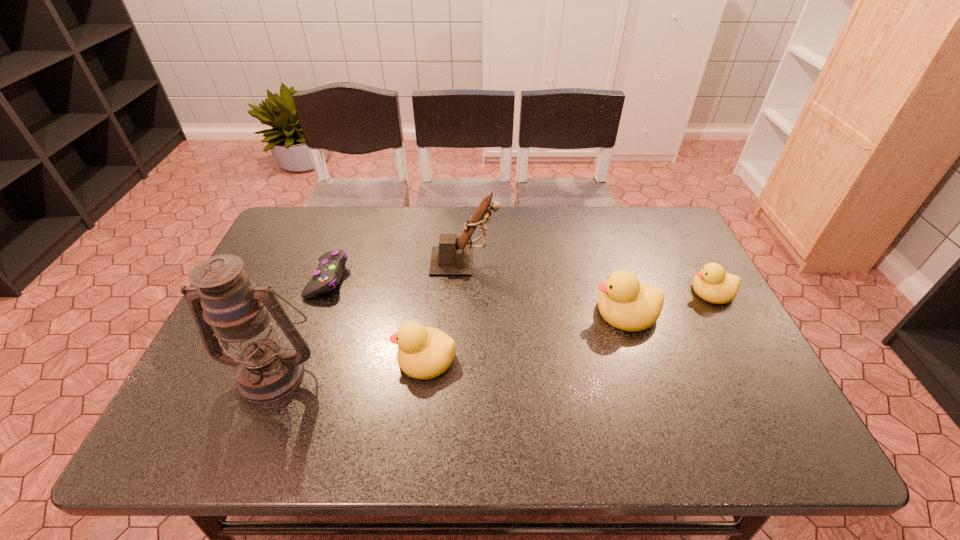
I want to click on blank area at the right edge, so click(x=671, y=269).

In the image, there is a desktop. At what (x,y) coordinates should I click in order to perform the action: click on free space at the far left corner. Please return your answer as a coordinate pair (x, y). The image size is (960, 540). Looking at the image, I should click on (324, 211).

Identify the location of vacant space at the near right corner. (710, 377).

Find the location of `vacant space in between the control and the second duckling from left to right`. vacant space in between the control and the second duckling from left to right is located at coordinates (477, 295).

At what (x,y) coordinates should I click in order to perform the action: click on empty space that is in between the control and the oil lamp. Please return your answer as a coordinate pair (x, y). Looking at the image, I should click on (300, 326).

At what (x,y) coordinates should I click in order to perform the action: click on free space between the control and the second shortest duckling. Please return your answer as a coordinate pair (x, y). This screenshot has width=960, height=540. Looking at the image, I should click on (376, 318).

Image resolution: width=960 pixels, height=540 pixels. Find the location of `free space that is in between the second duckling from left to right and the figurine`. free space that is in between the second duckling from left to right and the figurine is located at coordinates (545, 286).

Image resolution: width=960 pixels, height=540 pixels. I want to click on free space between the second duckling from left to right and the shortest object, so click(x=477, y=295).

This screenshot has width=960, height=540. Identify the location of free point between the control and the second shortest duckling. (376, 318).

Find the location of a particular element. This screenshot has width=960, height=540. free space between the control and the second shortest duckling is located at coordinates (376, 318).